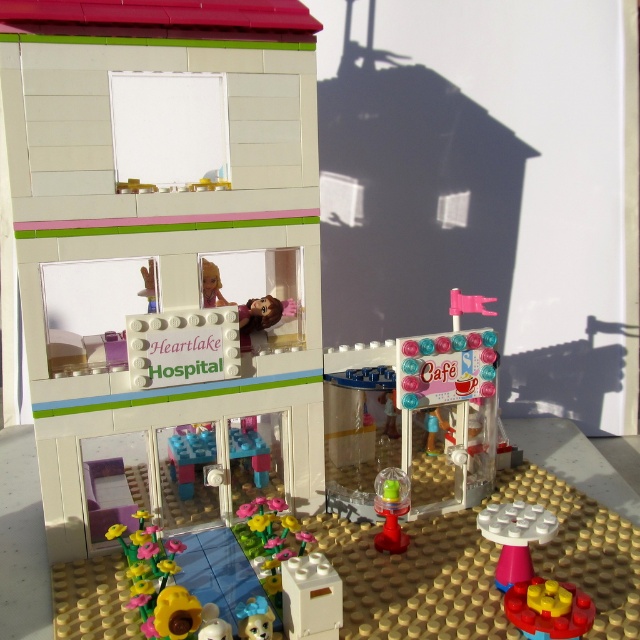
Is point (518, 529) closer to viewer compared to point (394, 525)?

Yes, it is.

Is white plastic table at lower center shorter than translucent yellow plastic cup at lower center?

Indeed, white plastic table at lower center has a lesser height compared to translucent yellow plastic cup at lower center.

Who is more distant from viewer, (520, 528) or (406, 483)?

Positioned behind is point (406, 483).

What are the coordinates of `white plastic table at lower center` in the screenshot? It's located at (515, 536).

Who is positioned more to the left, translucent plastic flower pot at lower center or white plastic table at lower center?

translucent plastic flower pot at lower center is more to the left.

Who is higher up, translucent plastic flower pot at lower center or white plastic table at lower center?

translucent plastic flower pot at lower center is higher up.

Is point (250, 451) behind point (497, 540)?

That is True.

I want to click on translucent plastic flower pot at lower center, so click(x=189, y=456).

Who is taller, yellow rubber toy at lower right or white plastic table at lower center?

white plastic table at lower center is taller.

What do you see at coordinates (548, 609) in the screenshot? I see `yellow rubber toy at lower right` at bounding box center [548, 609].

The image size is (640, 640). I want to click on yellow rubber toy at lower right, so click(x=548, y=609).